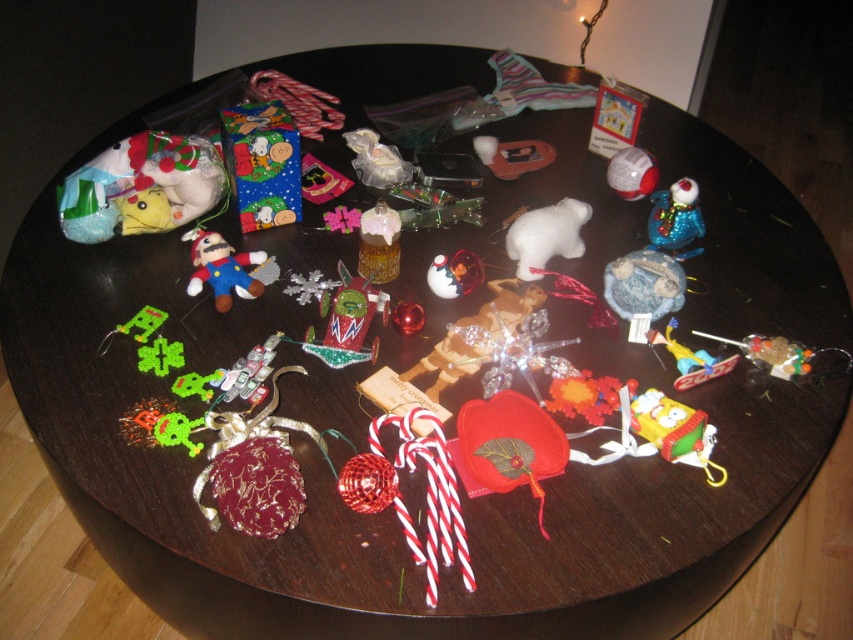
Does white felt bear at center appear under shiny blue ornament at upper right?

Yes.

What do you see at coordinates (544, 236) in the screenshot? The width and height of the screenshot is (853, 640). I see `white felt bear at center` at bounding box center [544, 236].

Find the location of a particular element. This screenshot has width=853, height=640. white felt bear at center is located at coordinates (544, 236).

Is shiny metallic car at center positioned before shiny blue ornament at upper right?

Yes, it is in front of shiny blue ornament at upper right.

Is point (370, 273) in front of point (648, 225)?

Yes, it is in front of point (648, 225).

Locate an element on the screen. shiny metallic car at center is located at coordinates pos(347,320).

Can you confirm if yellow fabric sponge at lower right is bigger than velvet plush mario at center?

No, yellow fabric sponge at lower right is not bigger than velvet plush mario at center.

Can you confirm if yellow fabric sponge at lower right is positioned to the left of velvet plush mario at center?

Incorrect, yellow fabric sponge at lower right is not on the left side of velvet plush mario at center.

You are a GUI agent. You are given a task and a screenshot of the screen. Output one action in this format:
    pyautogui.click(x=<x>, y=<y>)
    Task: Click on the yellow fabric sponge at lower right
    
    Given the screenshot: What is the action you would take?
    pyautogui.click(x=675, y=432)